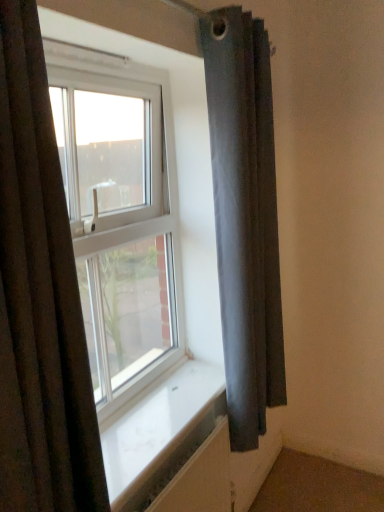
Question: Considering the relative sizes of dark gray fabric curtain at right, the 1th curtain in the right-to-left sequence, and white smooth window sill at center in the image provided, is dark gray fabric curtain at right, the 1th curtain in the right-to-left sequence, bigger than white smooth window sill at center?

Choices:
 (A) yes
 (B) no

Answer: (A)

Question: Is dark gray fabric curtain at right, the 1th curtain in the right-to-left sequence, turned away from white smooth window sill at center?

Choices:
 (A) yes
 (B) no

Answer: (B)

Question: Is the surface of dark gray fabric curtain at right, the 1th curtain in the right-to-left sequence, in direct contact with white smooth window sill at center?

Choices:
 (A) no
 (B) yes

Answer: (A)

Question: Is white smooth window sill at center located within dark gray fabric curtain at right, placed as the first curtain when sorted from back to front?

Choices:
 (A) no
 (B) yes

Answer: (A)

Question: Can you confirm if dark gray fabric curtain at right, which is the second curtain in front-to-back order, is wider than white smooth window sill at center?

Choices:
 (A) no
 (B) yes

Answer: (A)

Question: Does dark gray fabric curtain at right, placed as the second curtain when sorted from left to right, have a lesser height compared to white smooth window sill at center?

Choices:
 (A) yes
 (B) no

Answer: (B)

Question: Is dark fabric curtain at left, acting as the 1th curtain starting from the front, with transparent glass window at center?

Choices:
 (A) no
 (B) yes

Answer: (A)

Question: Can transparent glass window at center be found inside dark fabric curtain at left, which is the 2th curtain from right to left?

Choices:
 (A) yes
 (B) no

Answer: (B)

Question: Is dark fabric curtain at left, the 1th curtain in the left-to-right sequence, further to the viewer compared to transparent glass window at center?

Choices:
 (A) no
 (B) yes

Answer: (A)

Question: Considering the relative sizes of dark fabric curtain at left, the 1th curtain in the left-to-right sequence, and transparent glass window at center in the image provided, is dark fabric curtain at left, the 1th curtain in the left-to-right sequence, taller than transparent glass window at center?

Choices:
 (A) no
 (B) yes

Answer: (A)

Question: Does dark fabric curtain at left, the 1th curtain in the left-to-right sequence, have a larger size compared to transparent glass window at center?

Choices:
 (A) yes
 (B) no

Answer: (B)

Question: Considering the relative sizes of dark fabric curtain at left, acting as the 1th curtain starting from the front, and transparent glass window at center in the image provided, is dark fabric curtain at left, acting as the 1th curtain starting from the front, wider than transparent glass window at center?

Choices:
 (A) yes
 (B) no

Answer: (A)

Question: Does transparent glass window at center have a lesser height compared to white smooth window sill at center?

Choices:
 (A) no
 (B) yes

Answer: (A)